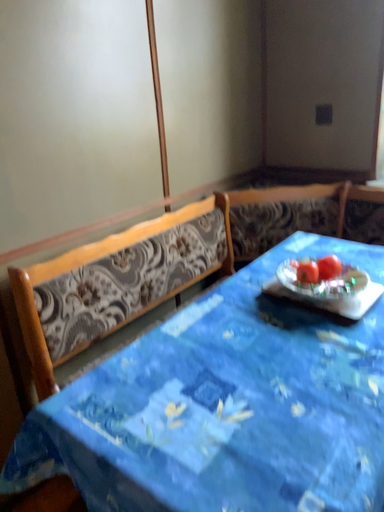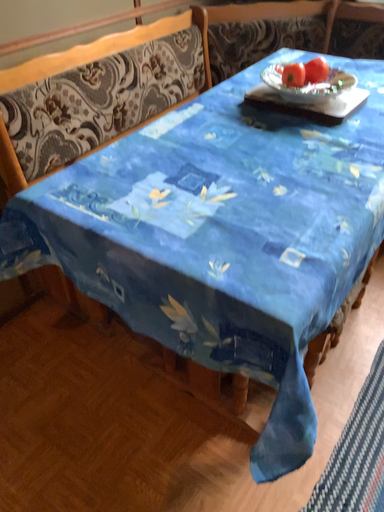
Question: Which way did the camera rotate in the video?

Choices:
 (A) rotated upward
 (B) rotated downward

Answer: (B)